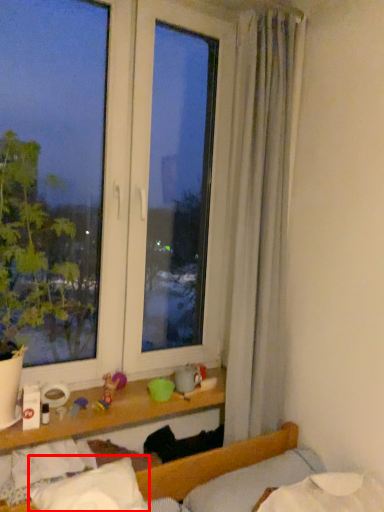
Question: From the image's perspective, considering the relative positions of pillow (annotated by the red box) and pillow in the image provided, where is pillow (annotated by the red box) located with respect to the staircase?

Choices:
 (A) below
 (B) above

Answer: (B)